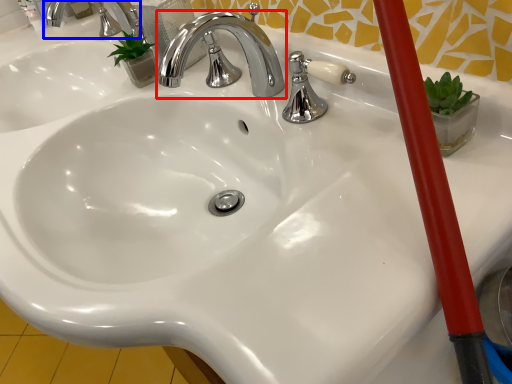
Question: Which object appears closest to the camera in this image, tap (highlighted by a red box) or tap (highlighted by a blue box)?

Choices:
 (A) tap
 (B) tap

Answer: (A)